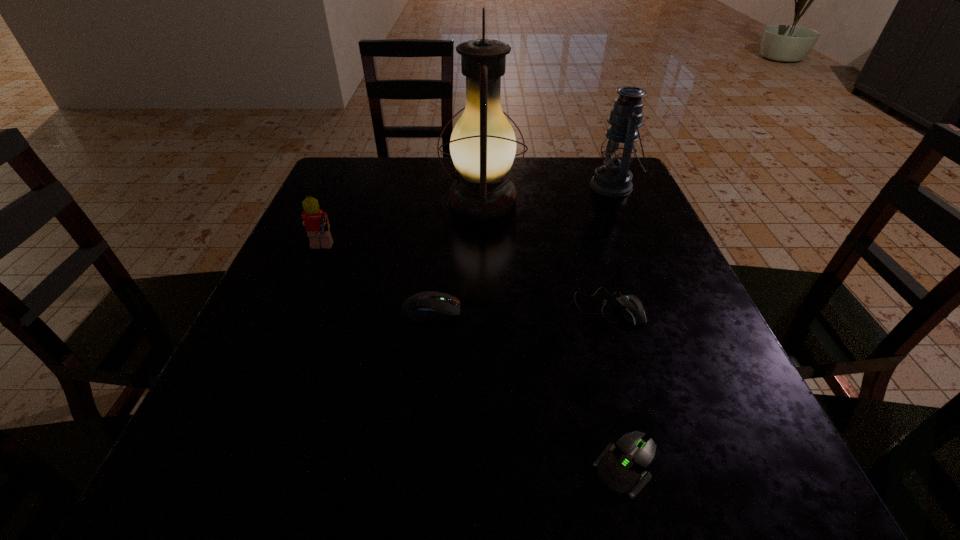
Locate an element on the screen. The height and width of the screenshot is (540, 960). object at the near right corner is located at coordinates (621, 467).

The height and width of the screenshot is (540, 960). What are the coordinates of `free space at the far edge of the desktop` in the screenshot? It's located at (396, 200).

I want to click on vacant space at the near edge, so click(499, 456).

Image resolution: width=960 pixels, height=540 pixels. In the image, there is a desktop. Identify the location of vacant area at the left edge. (348, 279).

What are the coordinates of `blank area at the right edge` in the screenshot? It's located at (645, 340).

Where is `vacant space at the far left corner of the desktop`? vacant space at the far left corner of the desktop is located at coordinates (378, 179).

In the image, there is a desktop. Where is `vacant region at the near left corner`? The image size is (960, 540). vacant region at the near left corner is located at coordinates (281, 448).

The width and height of the screenshot is (960, 540). What are the coordinates of `free space at the far right corner of the desktop` in the screenshot? It's located at (595, 197).

Identify the location of vacant space that is in between the nearest computer mouse and the tallest computer mouse. (529, 388).

You are a GUI agent. You are given a task and a screenshot of the screen. Output one action in this format:
    pyautogui.click(x=<x>, y=<y>)
    Task: Click on the vacant space that's between the lantern and the tallest object
    
    Given the screenshot: What is the action you would take?
    pyautogui.click(x=548, y=194)